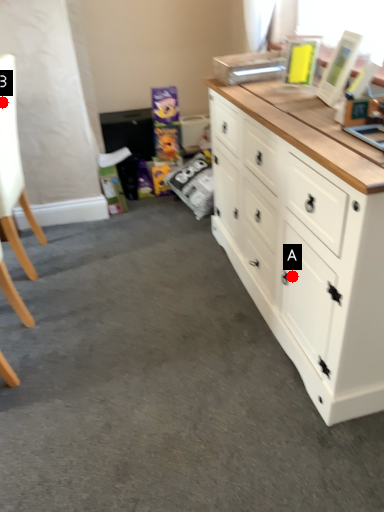
Question: Two points are circled on the image, labeled by A and B beside each circle. Which point is further to the camera?

Choices:
 (A) A is further
 (B) B is further

Answer: (B)